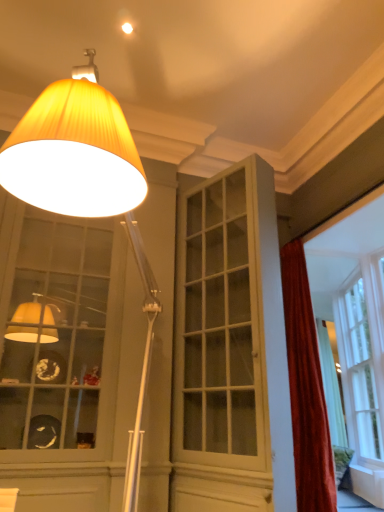
This screenshot has width=384, height=512. Describe the element at coordinates (83, 176) in the screenshot. I see `matte yellow fabric lampshade at upper left` at that location.

What do you see at coordinates (306, 389) in the screenshot? This screenshot has width=384, height=512. I see `velvet red curtain at right` at bounding box center [306, 389].

The height and width of the screenshot is (512, 384). Describe the element at coordinates (363, 356) in the screenshot. I see `white glass window at right, which is the 1th window from right to left` at that location.

Measure the distance between white glossy cabinet at center and camera.

They are 8.05 feet apart.

You are a GUI agent. You are given a task and a screenshot of the screen. Output one action in this format:
    pyautogui.click(x=<x>, y=<y>)
    Task: Click on the matte glass cabinet at left, marked as the first window in a left-to-right arrangement
    The image size is (384, 512).
    Given the screenshot: What is the action you would take?
    pyautogui.click(x=59, y=336)

Is white glass window at right, which is the 1th window from right to left, spatially inside matte glass cabinet at left, which appears as the 2th window when viewed from the right, or outside of it?

The correct answer is: outside.

Consider the image. Does white glass window at right, which is the 1th window from right to left, touch matte glass cabinet at left, which appears as the 2th window when viewed from the right?

There is a gap between white glass window at right, which is the 1th window from right to left, and matte glass cabinet at left, which appears as the 2th window when viewed from the right.

In the image, is white glass window at right, which is the 2th window from left to right, on the left side or the right side of matte glass cabinet at left, marked as the first window in a left-to-right arrangement?

In the image, white glass window at right, which is the 2th window from left to right, appears on the right side of matte glass cabinet at left, marked as the first window in a left-to-right arrangement.

Consider the image. Is white glass window at right, which is the 1th window from right to left, in front of or behind matte glass cabinet at left, marked as the first window in a left-to-right arrangement, in the image?

In the image, white glass window at right, which is the 1th window from right to left, appears behind matte glass cabinet at left, marked as the first window in a left-to-right arrangement.

Between velvet red curtain at right and white glossy cabinet at center, which one has smaller size?

Smaller between the two is velvet red curtain at right.

Which of these two, velvet red curtain at right or white glossy cabinet at center, stands shorter?

Standing shorter between the two is velvet red curtain at right.

Is velvet red curtain at right oriented towards white glossy cabinet at center?

Yes, velvet red curtain at right is facing white glossy cabinet at center.

From a real-world perspective, between velvet red curtain at right and white glossy cabinet at center, who is vertically higher?

white glossy cabinet at center, from a real-world perspective.

Can white glossy cabinet at center be found inside matte glass cabinet at left, which appears as the 2th window when viewed from the right?

No, matte glass cabinet at left, which appears as the 2th window when viewed from the right, does not contain white glossy cabinet at center.

Considering the sizes of objects matte glass cabinet at left, which appears as the 2th window when viewed from the right, and white glossy cabinet at center in the image provided, who is bigger, matte glass cabinet at left, which appears as the 2th window when viewed from the right, or white glossy cabinet at center?

Bigger between the two is matte glass cabinet at left, which appears as the 2th window when viewed from the right.

Considering the points (34, 421) and (225, 434), which point is in front, point (34, 421) or point (225, 434)?

The point (34, 421) is closer.

Which of these two, matte glass cabinet at left, which appears as the 2th window when viewed from the right, or white glossy cabinet at center, stands shorter?

matte glass cabinet at left, which appears as the 2th window when viewed from the right.

Locate an element on the screen. This screenshot has width=384, height=512. lamp that appears in front of the white glossy cabinet at center is located at coordinates (83, 176).

Is white glossy cabinet at center positioned with its back to matte yellow fabric lampshade at upper left?

white glossy cabinet at center does not have its back to matte yellow fabric lampshade at upper left.

Between white glossy cabinet at center and matte yellow fabric lampshade at upper left, which one appears on the right side from the viewer's perspective?

white glossy cabinet at center.

Considering the relative positions of velvet red curtain at right and matte glass cabinet at left, which appears as the 2th window when viewed from the right, in the image provided, is velvet red curtain at right to the left of matte glass cabinet at left, which appears as the 2th window when viewed from the right, from the viewer's perspective?

No.

Where is `curtain lying behind the matte glass cabinet at left, which appears as the 2th window when viewed from the right`? The height and width of the screenshot is (512, 384). curtain lying behind the matte glass cabinet at left, which appears as the 2th window when viewed from the right is located at coordinates (306, 389).

Can you tell me how much velvet red curtain at right and matte glass cabinet at left, which appears as the 2th window when viewed from the right, differ in facing direction?

The angle between the facing direction of velvet red curtain at right and the facing direction of matte glass cabinet at left, which appears as the 2th window when viewed from the right, is 93.1 degrees.

Is white glossy cabinet at center to the right of matte glass cabinet at left, marked as the first window in a left-to-right arrangement, from the viewer's perspective?

Correct, you'll find white glossy cabinet at center to the right of matte glass cabinet at left, marked as the first window in a left-to-right arrangement.

Is white glossy cabinet at center taller or shorter than matte glass cabinet at left, which appears as the 2th window when viewed from the right?

Considering their sizes, white glossy cabinet at center has more height than matte glass cabinet at left, which appears as the 2th window when viewed from the right.

Between white glossy cabinet at center and matte glass cabinet at left, which appears as the 2th window when viewed from the right, which one has smaller width?

white glossy cabinet at center is thinner.

From the image's perspective, is white glass window at right, which is the 2th window from left to right, positioned above or below white glossy cabinet at center?

white glass window at right, which is the 2th window from left to right, is below white glossy cabinet at center.

From a real-world perspective, is white glass window at right, which is the 1th window from right to left, located beneath white glossy cabinet at center?

Correct, in the physical world, white glass window at right, which is the 1th window from right to left, is lower than white glossy cabinet at center.

Which object is positioned more to the left, white glass window at right, which is the 1th window from right to left, or white glossy cabinet at center?

Positioned to the left is white glossy cabinet at center.

Between white glass window at right, which is the 1th window from right to left, and white glossy cabinet at center, which one has less height?

white glass window at right, which is the 1th window from right to left, is shorter.

At what (x,y) coordinates should I click in order to perform the action: click on window below the matte glass cabinet at left, which appears as the 2th window when viewed from the right (from a real-world perspective). Please return your answer as a coordinate pair (x, y). Looking at the image, I should click on (363, 356).

Find the location of a particular element. The height and width of the screenshot is (512, 384). screen door located above the velvet red curtain at right (from a real-world perspective) is located at coordinates (224, 342).

Which object lies further to the anchor point matte yellow fabric lampshade at upper left, white glass window at right, which is the 1th window from right to left, or velvet red curtain at right?

white glass window at right, which is the 1th window from right to left.

Looking at the image, which one is located further to matte glass cabinet at left, marked as the first window in a left-to-right arrangement, white glossy cabinet at center or white glass window at right, which is the 1th window from right to left?

Among the two, white glass window at right, which is the 1th window from right to left, is located further to matte glass cabinet at left, marked as the first window in a left-to-right arrangement.

Based on their spatial positions, is velvet red curtain at right or matte yellow fabric lampshade at upper left further from matte glass cabinet at left, marked as the first window in a left-to-right arrangement?

matte yellow fabric lampshade at upper left lies further to matte glass cabinet at left, marked as the first window in a left-to-right arrangement, than the other object.

From the image, which object appears to be nearer to white glossy cabinet at center, matte glass cabinet at left, which appears as the 2th window when viewed from the right, or velvet red curtain at right?

velvet red curtain at right.

When comparing their distances from white glossy cabinet at center, does matte yellow fabric lampshade at upper left or matte glass cabinet at left, which appears as the 2th window when viewed from the right, seem further?

matte yellow fabric lampshade at upper left is further to white glossy cabinet at center.

Considering their positions, is white glossy cabinet at center positioned closer to velvet red curtain at right than matte yellow fabric lampshade at upper left?

white glossy cabinet at center lies closer to velvet red curtain at right than the other object.

From the image, which object appears to be nearer to matte glass cabinet at left, which appears as the 2th window when viewed from the right, white glass window at right, which is the 2th window from left to right, or matte yellow fabric lampshade at upper left?

Among the two, matte yellow fabric lampshade at upper left is located nearer to matte glass cabinet at left, which appears as the 2th window when viewed from the right.

Estimate the real-world distances between objects in this image. Which object is further from matte glass cabinet at left, which appears as the 2th window when viewed from the right, matte yellow fabric lampshade at upper left or white glass window at right, which is the 2th window from left to right?

white glass window at right, which is the 2th window from left to right, is further to matte glass cabinet at left, which appears as the 2th window when viewed from the right.

This screenshot has width=384, height=512. I want to click on screen door between matte glass cabinet at left, which appears as the 2th window when viewed from the right, and velvet red curtain at right, in the horizontal direction, so click(x=224, y=342).

Locate an element on the screen. This screenshot has height=512, width=384. screen door between matte yellow fabric lampshade at upper left and matte glass cabinet at left, which appears as the 2th window when viewed from the right, along the z-axis is located at coordinates (224, 342).

The height and width of the screenshot is (512, 384). I want to click on curtain between white glossy cabinet at center and white glass window at right, which is the 1th window from right to left, in the horizontal direction, so click(306, 389).

This screenshot has width=384, height=512. I want to click on screen door positioned between matte yellow fabric lampshade at upper left and white glass window at right, which is the 1th window from right to left, from near to far, so click(x=224, y=342).